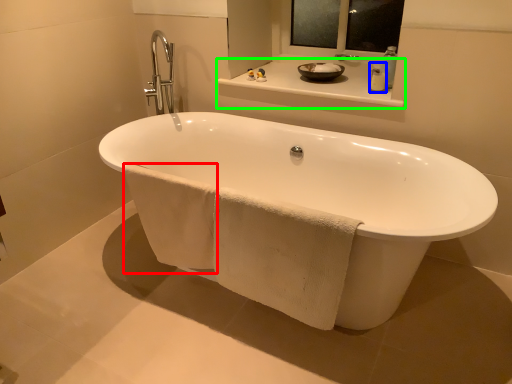
Question: Considering the real-world distances, which object is farthest from bath towel (highlighted by a red box)? soap dispenser (highlighted by a blue box) or counter top (highlighted by a green box)?

Choices:
 (A) soap dispenser
 (B) counter top

Answer: (A)